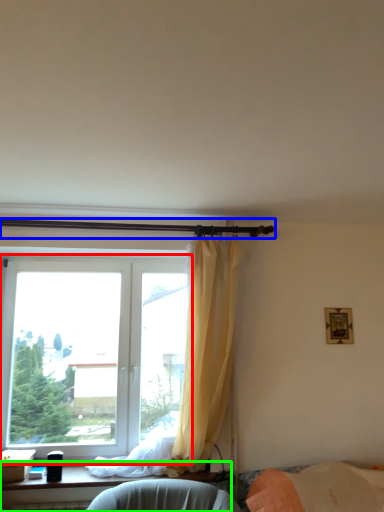
Question: Which object is the closest to the window (highlighted by a red box)? Choose among these: beam (highlighted by a blue box) or furniture (highlighted by a green box).

Choices:
 (A) beam
 (B) furniture

Answer: (B)